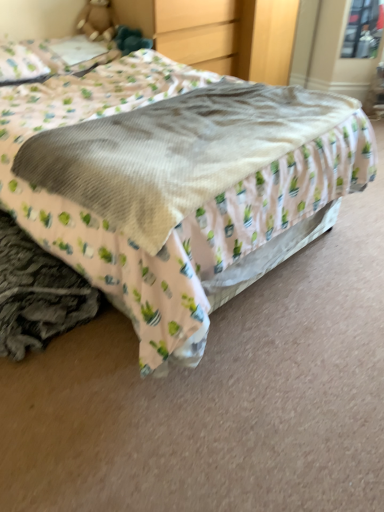
Question: Does white fabric pillow at upper left come behind soft beige blanket at center?

Choices:
 (A) yes
 (B) no

Answer: (A)

Question: From the image's perspective, is white fabric pillow at upper left under soft beige blanket at center?

Choices:
 (A) yes
 (B) no

Answer: (B)

Question: Does white fabric pillow at upper left have a smaller size compared to soft beige blanket at center?

Choices:
 (A) no
 (B) yes

Answer: (B)

Question: Can we say white fabric pillow at upper left lies outside soft beige blanket at center?

Choices:
 (A) no
 (B) yes

Answer: (B)

Question: Can you confirm if white fabric pillow at upper left is thinner than soft beige blanket at center?

Choices:
 (A) no
 (B) yes

Answer: (B)

Question: Considering the relative positions of white fabric pillow at upper left and matte wood dresser at upper center in the image provided, is white fabric pillow at upper left to the left or to the right of matte wood dresser at upper center?

Choices:
 (A) left
 (B) right

Answer: (A)

Question: Considering the positions of white fabric pillow at upper left and matte wood dresser at upper center in the image, is white fabric pillow at upper left taller or shorter than matte wood dresser at upper center?

Choices:
 (A) tall
 (B) short

Answer: (B)

Question: Considering the positions of point (24, 65) and point (248, 54), is point (24, 65) closer or farther from the camera than point (248, 54)?

Choices:
 (A) farther
 (B) closer

Answer: (B)

Question: From a real-world perspective, is white fabric pillow at upper left physically located above or below matte wood dresser at upper center?

Choices:
 (A) above
 (B) below

Answer: (A)

Question: Based on their sizes in the image, would you say matte wood dresser at upper center is bigger or smaller than soft beige blanket at center?

Choices:
 (A) big
 (B) small

Answer: (A)

Question: Visually, is matte wood dresser at upper center positioned to the left or to the right of soft beige blanket at center?

Choices:
 (A) left
 (B) right

Answer: (A)

Question: In the image, is matte wood dresser at upper center positioned in front of or behind soft beige blanket at center?

Choices:
 (A) behind
 (B) front

Answer: (A)

Question: From a real-world perspective, is matte wood dresser at upper center positioned above or below soft beige blanket at center?

Choices:
 (A) below
 (B) above

Answer: (B)

Question: Relative to matte wood dresser at upper center, is transparent glass window at upper right in front or behind?

Choices:
 (A) front
 (B) behind

Answer: (B)

Question: From a real-world perspective, is transparent glass window at upper right above or below matte wood dresser at upper center?

Choices:
 (A) above
 (B) below

Answer: (B)